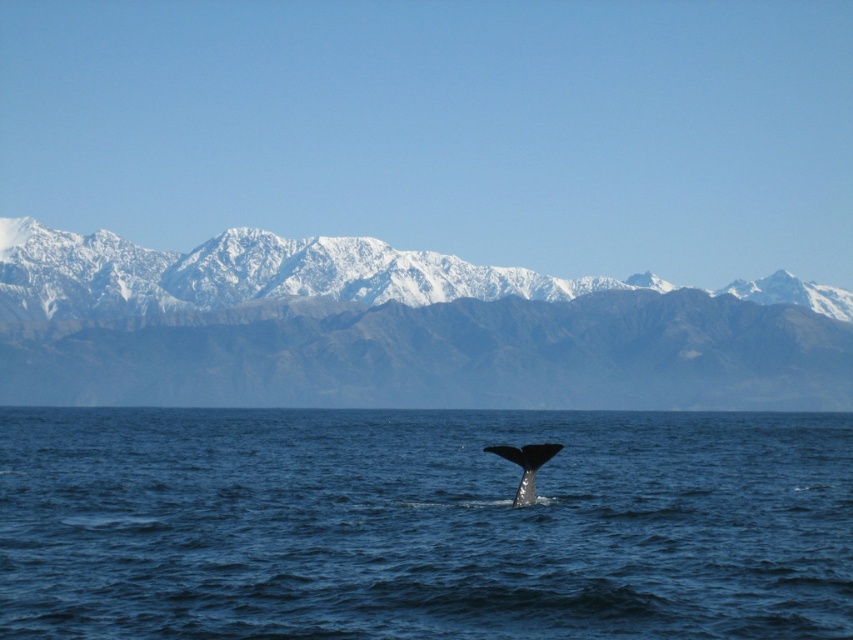
You are a marine biologist observing the scene from a boat. You notice the blue water at tail center and the gray smooth whale tail at lower center. Based on their positions, which object is farther from your current position?

The blue water at tail center is farther from your current position since it is 163.16 meters away from the gray smooth whale tail at lower center, which is closer to the boat.

You are standing on a boat and see two points in the water. The first point is at coordinate point[544,266] and the second is at point[643,496]. Which point is closer to the boat?

Point[544,266] is closer to the boat because it is further to the camera than point[643,496].

You are a marine biologist observing the scene from a boat. You notice the snowy rock mountain range at upper center and the gray smooth whale tail at lower center. How far apart are these two landmarks in feet?

The snowy rock mountain range at upper center is 1194.04 feet from the gray smooth whale tail at lower center.